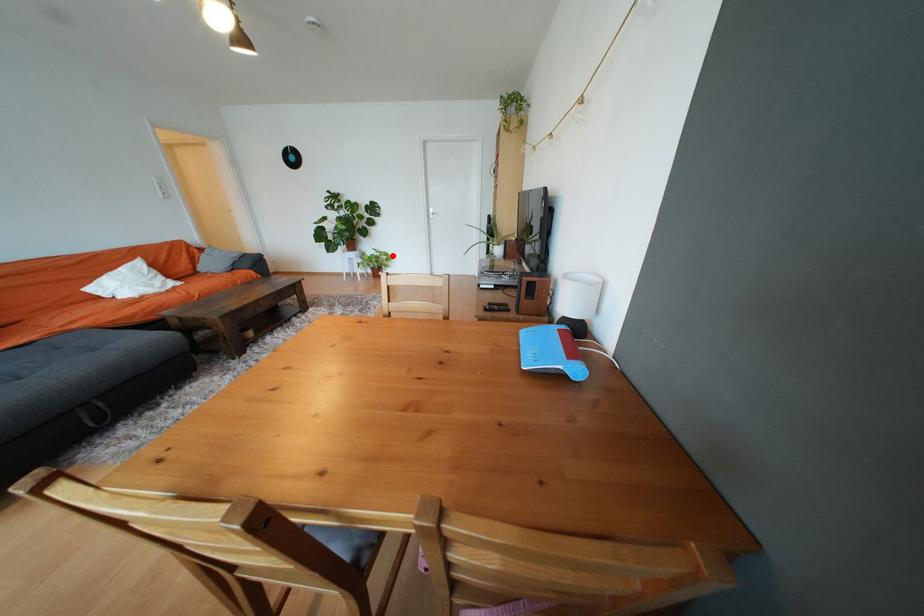
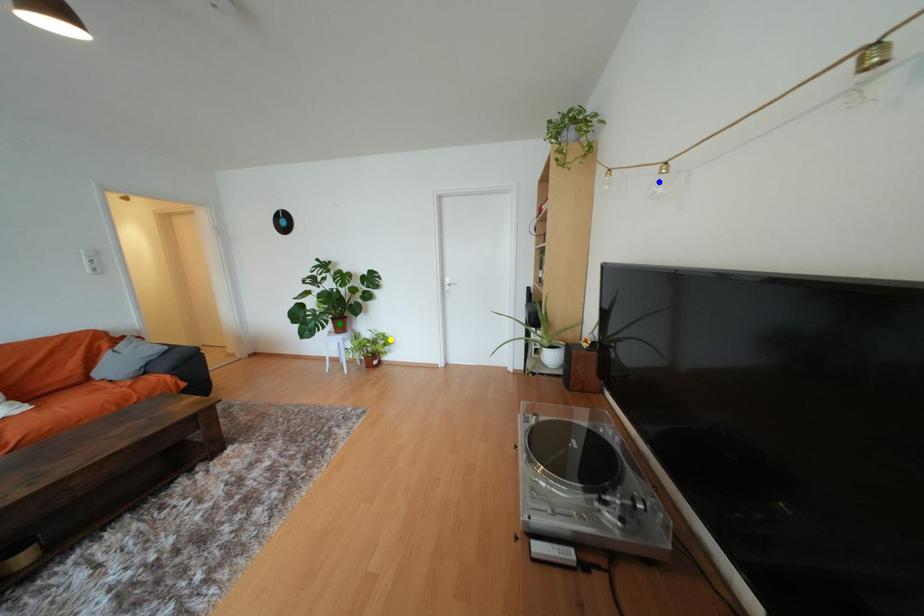
Question: I am providing you with two images of the same scene from different viewpoints. A red point is marked on the first image. You are given multiple points on the second image. Which spot in image 2 lines up with the point in image 1?

Choices:
 (A) blue point
 (B) green point
 (C) yellow point

Answer: (C)